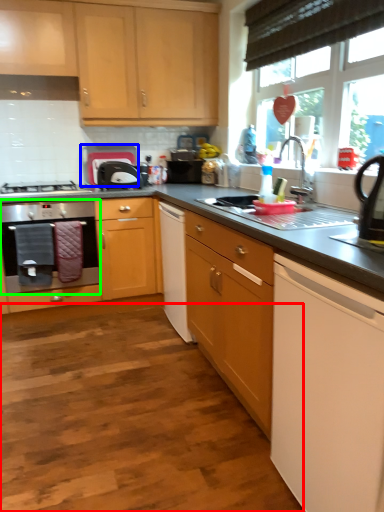
Question: Based on their relative distances, which object is nearer to plain (highlighted by a red box)? Choose from appliance (highlighted by a blue box) and home appliance (highlighted by a green box).

Choices:
 (A) appliance
 (B) home appliance

Answer: (B)